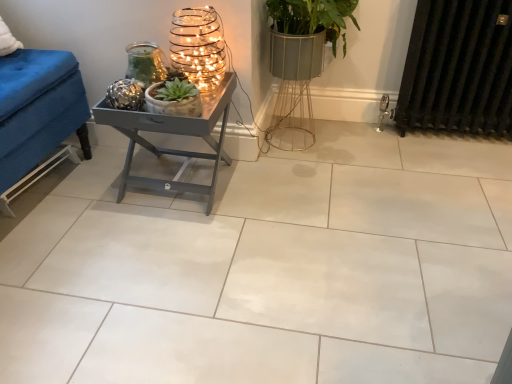
Image resolution: width=512 pixels, height=384 pixels. In order to click on empty space that is ontop of metallic gray table at center (from a real-world perspective) in this screenshot , I will do `click(158, 84)`.